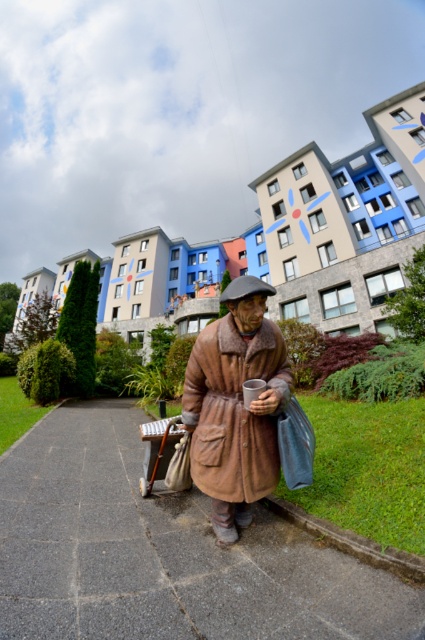
Is smooth concrete pavement at center thinner than gray concrete curb at lower center?

No.

Which is behind, point (322, 548) or point (391, 554)?

The point (322, 548) is more distant.

Locate an element on the screen. The image size is (425, 640). smooth concrete pavement at center is located at coordinates (164, 554).

Does point (255, 307) come farther from viewer compared to point (360, 550)?

Yes, it is behind point (360, 550).

Is brown woolen coat at center to the left of gray concrete curb at lower center from the viewer's perspective?

Yes, brown woolen coat at center is to the left of gray concrete curb at lower center.

What do you see at coordinates (235, 404) in the screenshot? I see `brown woolen coat at center` at bounding box center [235, 404].

The width and height of the screenshot is (425, 640). I want to click on brown woolen coat at center, so click(235, 404).

Does smooth concrete pavement at center appear over brown woolen coat at center?

No, smooth concrete pavement at center is not above brown woolen coat at center.

Which is below, smooth concrete pavement at center or brown woolen coat at center?

smooth concrete pavement at center is lower down.

In order to click on smooth concrete pavement at center in this screenshot , I will do `click(164, 554)`.

Identify the location of smooth concrete pavement at center. (164, 554).